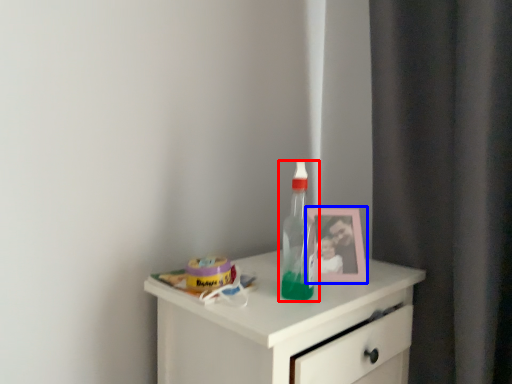
Question: Which object is further to the camera taking this photo, bottle (highlighted by a red box) or picture frame (highlighted by a blue box)?

Choices:
 (A) bottle
 (B) picture frame

Answer: (B)